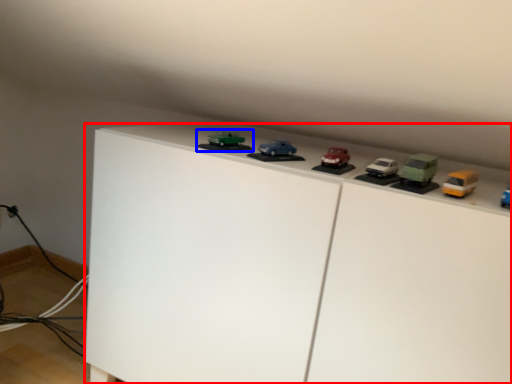
Question: Which object appears closest to the camera in this image, furniture (highlighted by a red box) or toy (highlighted by a blue box)?

Choices:
 (A) furniture
 (B) toy

Answer: (A)